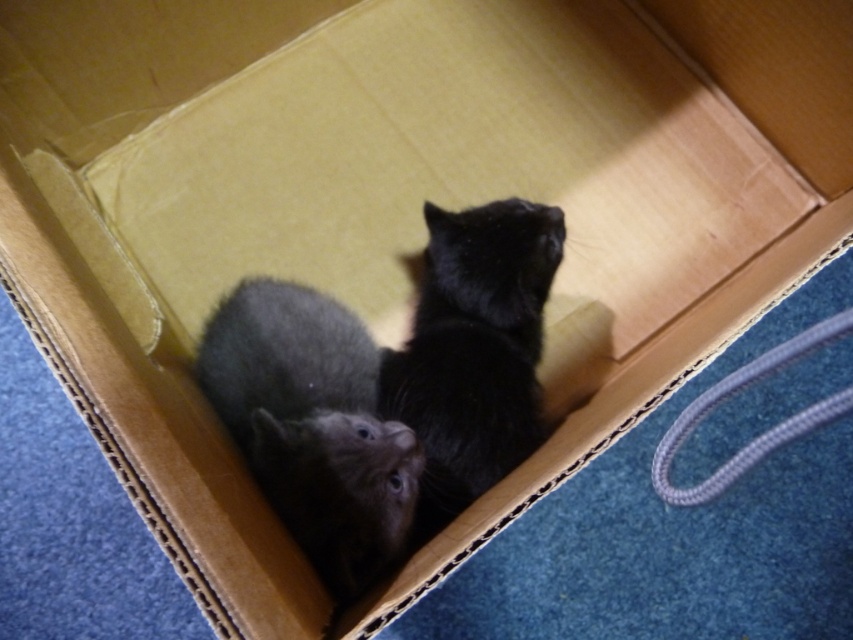
You are a toy mouse that wants to fit between the fuzzy gray cat at center and the black fluffy cat at center. Which cat has a wider body so you can choose the narrower space to squeeze through?

The fuzzy gray cat at center is wider than the black fluffy cat at center, so you should choose the space next to the black fluffy cat at center to squeeze through since it has a narrower body.

From the picture: You are trying to separate the two kittens. Since you need to pick up the fuzzy gray cat at center first, which direction should you reach towards relative to the black fluffy cat at center?

You should reach towards the left side relative to the black fluffy cat at center because the fuzzy gray cat at center is positioned to the left of the black fluffy cat at center.